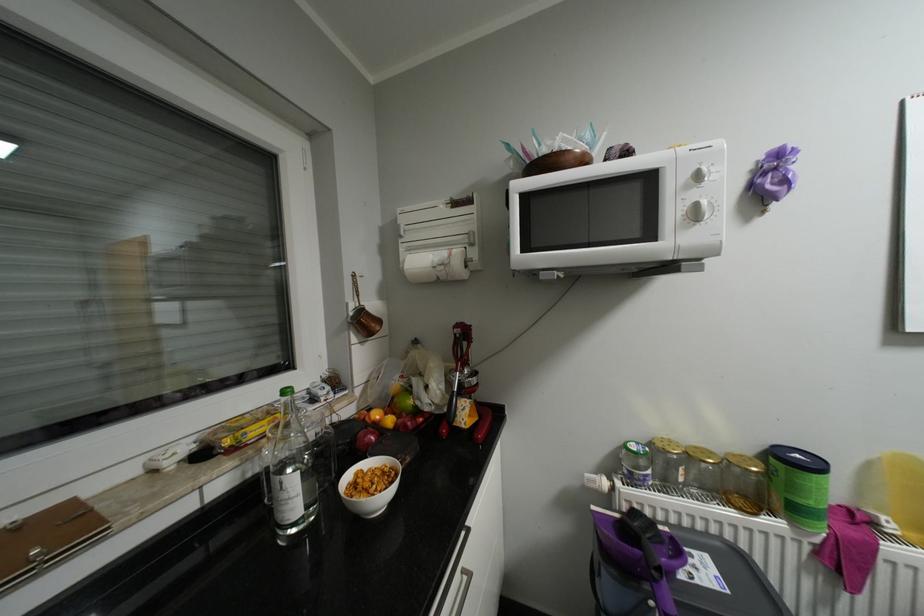
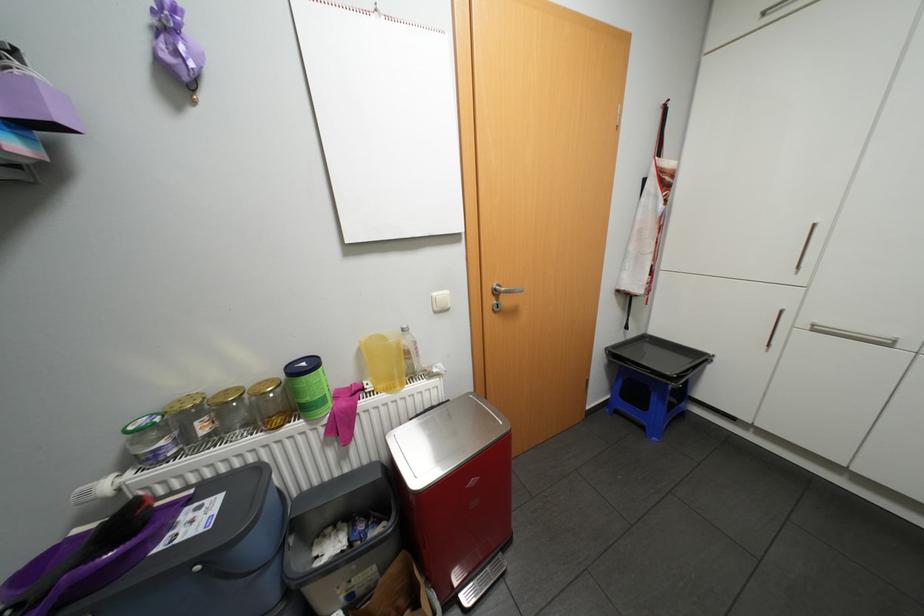
First-person continuous shooting, in which direction is the camera rotating?

The camera rotated toward right-down.